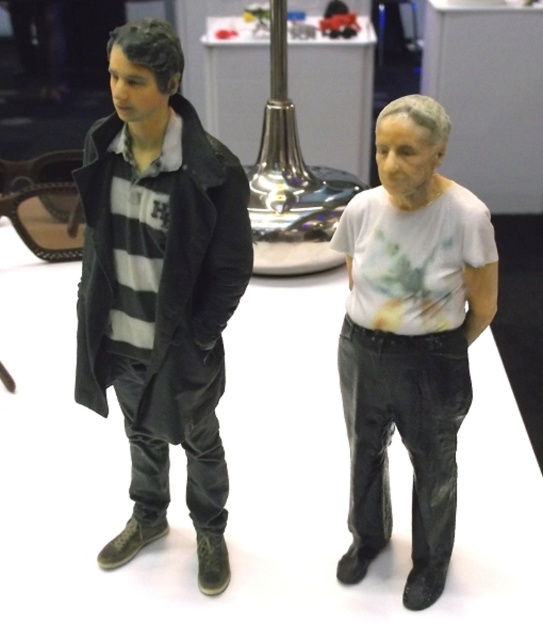
Question: Does matte black coat at left appear on the left side of white matte t-shirt at center?

Choices:
 (A) yes
 (B) no

Answer: (A)

Question: Where is matte black coat at left located in relation to white matte t-shirt at center in the image?

Choices:
 (A) right
 (B) left

Answer: (B)

Question: Is matte black coat at left closer to camera compared to white matte t-shirt at center?

Choices:
 (A) no
 (B) yes

Answer: (B)

Question: Among these points, which one is farthest from the camera?

Choices:
 (A) (390, 301)
 (B) (204, 378)

Answer: (B)

Question: Which object appears farthest from the camera in this image?

Choices:
 (A) matte black coat at left
 (B) white matte t-shirt at center

Answer: (B)